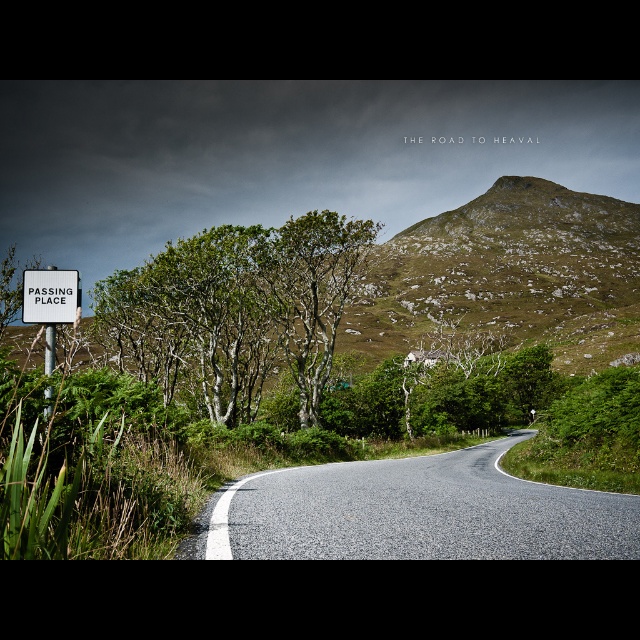
You are standing at the starting point of the road and want to reach the mountain in the distance. Which direction should you head towards, considering the green leafy tree at left is in your way?

The green leafy tree at left is located at point (237,308), so you should head towards the right side of the road to avoid the tree and continue towards the mountain.

You are driving a car that is 15 feet long. You see the green leafy tree at left and the white plastic sign at left on the side of the road. Can your car fit entirely between them without touching either?

The distance between the green leafy tree at left and the white plastic sign at left is 59.29 feet. Since your car is only 15 feet long, it can easily fit between them without touching either.